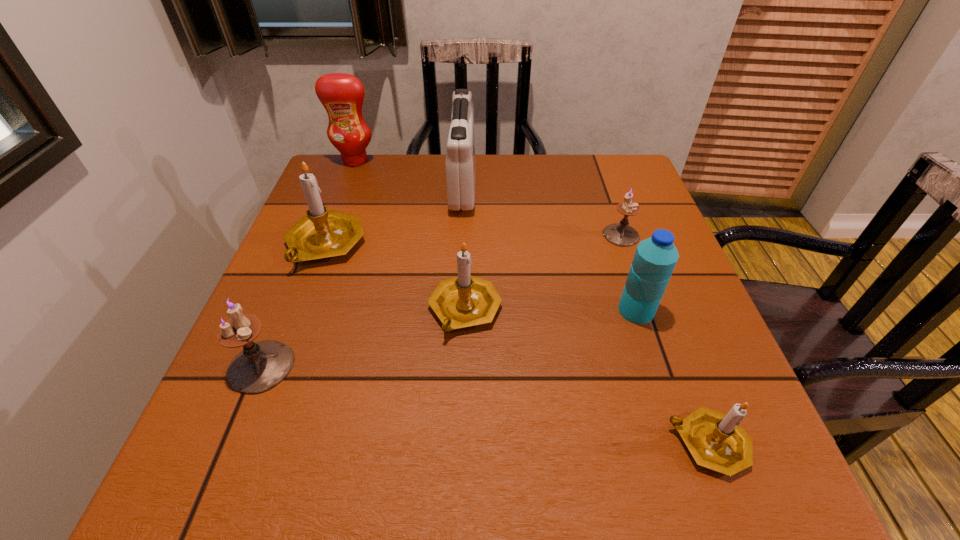
At what (x,y) coordinates should I click in order to perform the action: click on condiment. Please return your answer as a coordinate pair (x, y). This screenshot has height=540, width=960. Looking at the image, I should click on (341, 94).

Find the location of a particular element. This screenshot has width=960, height=540. the first-aid kit is located at coordinates (460, 163).

You are a GUI agent. You are given a task and a screenshot of the screen. Output one action in this format:
    pyautogui.click(x=<x>, y=<y>)
    Task: Click on the tallest candle holder
    This screenshot has height=540, width=960.
    Given the screenshot: What is the action you would take?
    pyautogui.click(x=321, y=234)

I want to click on the biggest gold candle holder, so click(321, 234).

Identify the location of water bottle. The image size is (960, 540). (655, 258).

Locate an element on the screen. This screenshot has height=540, width=960. the second biggest gold candle holder is located at coordinates (463, 301).

Identify the location of the third candle holder from left to right. (463, 301).

The height and width of the screenshot is (540, 960). I want to click on the bigger purple candle holder, so click(262, 365).

This screenshot has height=540, width=960. Identify the location of the nearer purple candle holder. (262, 365).

Image resolution: width=960 pixels, height=540 pixels. What are the coordinates of `the smaller purple candle holder` in the screenshot? It's located at (621, 234).